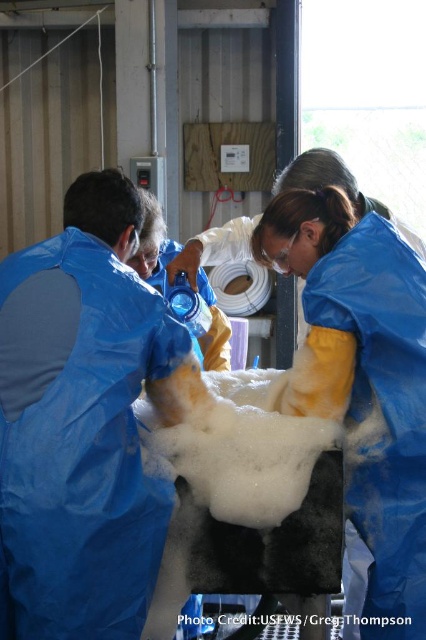
Which is below, blue plastic bag at left or blue protective suit at center?

Positioned lower is blue protective suit at center.

Who is more forward, (166, 376) or (348, 483)?

Point (166, 376) is more forward.

I want to click on blue plastic bag at left, so click(80, 422).

You are a GUI agent. You are given a task and a screenshot of the screen. Output one action in this format:
    pyautogui.click(x=<x>, y=<y>)
    Task: Click on the blue plastic bag at left
    Image resolution: width=426 pixels, height=640 pixels.
    Given the screenshot: What is the action you would take?
    pyautogui.click(x=80, y=422)